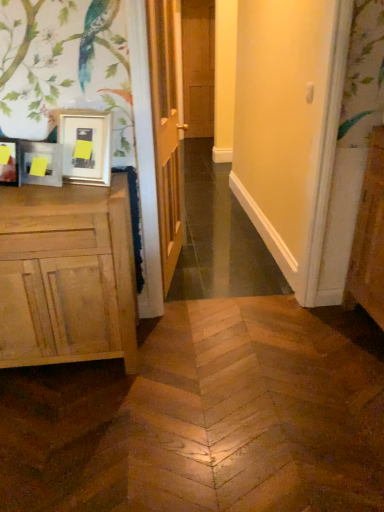
You are a GUI agent. You are given a task and a screenshot of the screen. Output one action in this format:
    pyautogui.click(x=<x>, y=<y>)
    Task: Click on the vacant area on top of natural wood cabinet at left (from a real-world perspective)
    This screenshot has width=384, height=512.
    Given the screenshot: What is the action you would take?
    click(x=53, y=193)